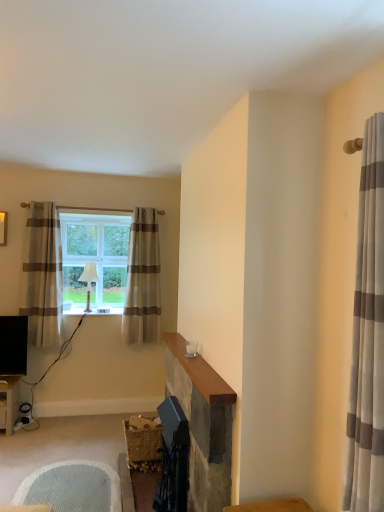
This screenshot has height=512, width=384. What do you see at coordinates (42, 275) in the screenshot?
I see `beige striped curtain at left, the 1th curtain from the left` at bounding box center [42, 275].

Locate an element on the screen. white textured rug at lower left is located at coordinates (72, 487).

What do you see at coordinates (94, 260) in the screenshot? Image resolution: width=384 pixels, height=512 pixels. I see `clear glass window at center` at bounding box center [94, 260].

I want to click on gray striped fabric curtain at right, the third curtain positioned from the back, so click(x=368, y=335).

You are a GUI agent. You are given a task and a screenshot of the screen. Output one action in this format:
    pyautogui.click(x=<x>, y=<y>)
    Task: Click on the beige striped curtain at center, the second curtain positioned from the left
    This screenshot has height=512, width=384.
    Given the screenshot: What is the action you would take?
    pyautogui.click(x=142, y=280)

Does point (72, 485) come behind point (38, 223)?

No, it is not.

Is beige striped curtain at left, arranged as the second curtain when viewed from the back, located within white textured rug at lower left?

That's incorrect, beige striped curtain at left, arranged as the second curtain when viewed from the back, is not inside white textured rug at lower left.

From the image's perspective, who appears lower, white textured rug at lower left or beige striped curtain at left, marked as the second curtain in a front-to-back arrangement?

white textured rug at lower left is shown below in the image.

What's the angular difference between beige striped curtain at left, the 1th curtain from the left, and white fabric lampshade at window's facing directions?

The angular difference between beige striped curtain at left, the 1th curtain from the left, and white fabric lampshade at window is 0.000112 degrees.

Does beige striped curtain at left, marked as the second curtain in a front-to-back arrangement, appear on the left side of white fabric lampshade at window?

Yes, beige striped curtain at left, marked as the second curtain in a front-to-back arrangement, is to the left of white fabric lampshade at window.

From the image's perspective, is beige striped curtain at left, marked as the third curtain in a right-to-left arrangement, on top of white fabric lampshade at window?

Yes, from the image's perspective, beige striped curtain at left, marked as the third curtain in a right-to-left arrangement, is on top of white fabric lampshade at window.

Can we say clear glass window at center lies outside gray striped fabric curtain at right, the 1th curtain in the front-to-back sequence?

Yes, clear glass window at center is outside of gray striped fabric curtain at right, the 1th curtain in the front-to-back sequence.

Is point (88, 211) farther from camera compared to point (378, 178)?

That is True.

Is clear glass window at center bigger or smaller than gray striped fabric curtain at right, the third curtain positioned from the back?

Clearly, clear glass window at center is larger in size than gray striped fabric curtain at right, the third curtain positioned from the back.

Is gray striped fabric curtain at right, the third curtain positioned from the back, oriented towards white fabric lampshade at window?

No, gray striped fabric curtain at right, the third curtain positioned from the back, is not aimed at white fabric lampshade at window.

Is gray striped fabric curtain at right, the 1th curtain in the front-to-back sequence, smaller than white fabric lampshade at window?

No, gray striped fabric curtain at right, the 1th curtain in the front-to-back sequence, is not smaller than white fabric lampshade at window.

From a real-world perspective, is gray striped fabric curtain at right, the 1th curtain in the front-to-back sequence, beneath white fabric lampshade at window?

No, from a real-world perspective, gray striped fabric curtain at right, the 1th curtain in the front-to-back sequence, is not below white fabric lampshade at window.

Relative to white fabric lampshade at window, is gray striped fabric curtain at right, the third curtain positioned from the back, in front or behind?

In the image, gray striped fabric curtain at right, the third curtain positioned from the back, appears in front of white fabric lampshade at window.

From a real-world perspective, is white fabric lampshade at window under white textured rug at lower left?

No.

The image size is (384, 512). What are the coordinates of `lamp to the left of white textured rug at lower left` in the screenshot? It's located at (89, 281).

Is white textured rug at lower left surrounded by white fabric lampshade at window?

No.

Is white fabric lampshade at window in contact with smooth stone fireplace at center?

white fabric lampshade at window and smooth stone fireplace at center are not in contact.

In terms of height, does white fabric lampshade at window look taller or shorter compared to smooth stone fireplace at center?

white fabric lampshade at window is shorter than smooth stone fireplace at center.

Is white fabric lampshade at window oriented away from smooth stone fireplace at center?

That's not correct — white fabric lampshade at window is not looking away from smooth stone fireplace at center.

Does white fabric lampshade at window come behind smooth stone fireplace at center?

Yes, white fabric lampshade at window is further from the viewer.

Which is correct: beige striped curtain at center, positioned as the 2th curtain in right-to-left order, is inside white textured rug at lower left, or outside of it?

beige striped curtain at center, positioned as the 2th curtain in right-to-left order, cannot be found inside white textured rug at lower left.

Considering the sizes of objects beige striped curtain at center, which ranks as the 3th curtain in front-to-back order, and white textured rug at lower left in the image provided, who is thinner, beige striped curtain at center, which ranks as the 3th curtain in front-to-back order, or white textured rug at lower left?

Thinner between the two is beige striped curtain at center, which ranks as the 3th curtain in front-to-back order.

Which point is more forward, (130, 250) or (77, 509)?

The point (77, 509) is more forward.

Find the location of a particular element. swivel chair below the beige striped curtain at left, marked as the second curtain in a front-to-back arrangement (from a real-world perspective) is located at coordinates (72, 487).

You are a GUI agent. You are given a task and a screenshot of the screen. Output one action in this format:
    pyautogui.click(x=<x>, y=<y>)
    Task: Click on the curtain on the left of the white fabric lampshade at window
    The height and width of the screenshot is (512, 384).
    Given the screenshot: What is the action you would take?
    pyautogui.click(x=42, y=275)

Which object lies nearer to the anchor point smooth stone fireplace at center, white textured rug at lower left or clear glass window at center?

Among the two, white textured rug at lower left is located nearer to smooth stone fireplace at center.

Which object lies nearer to the anchor point beige striped curtain at center, which ranks as the first curtain in back-to-front order, gray striped fabric curtain at right, the third curtain positioned from the back, or white textured rug at lower left?

Among the two, white textured rug at lower left is located nearer to beige striped curtain at center, which ranks as the first curtain in back-to-front order.

Looking at this image, when comparing their distances from white textured rug at lower left, does white fabric lampshade at window or beige striped curtain at left, marked as the second curtain in a front-to-back arrangement, seem further?

white fabric lampshade at window is further to white textured rug at lower left.

Which object lies further to the anchor point white fabric lampshade at window, smooth stone fireplace at center or gray striped fabric curtain at right, the third curtain positioned from the back?

The object further to white fabric lampshade at window is gray striped fabric curtain at right, the third curtain positioned from the back.

Looking at this image, considering their positions, is beige striped curtain at left, marked as the second curtain in a front-to-back arrangement, positioned further to clear glass window at center than beige striped curtain at center, which ranks as the first curtain in back-to-front order?

beige striped curtain at center, which ranks as the first curtain in back-to-front order, is positioned further to the anchor clear glass window at center.

Which object lies further to the anchor point beige striped curtain at center, which ranks as the first curtain in back-to-front order, white fabric lampshade at window or beige striped curtain at left, arranged as the second curtain when viewed from the back?

The object further to beige striped curtain at center, which ranks as the first curtain in back-to-front order, is beige striped curtain at left, arranged as the second curtain when viewed from the back.

Estimate the real-world distances between objects in this image. Which object is further from gray striped fabric curtain at right, the third curtain positioned from the back, white fabric lampshade at window or clear glass window at center?

The object further to gray striped fabric curtain at right, the third curtain positioned from the back, is clear glass window at center.

Considering their positions, is white textured rug at lower left positioned further to clear glass window at center than white fabric lampshade at window?

The object further to clear glass window at center is white textured rug at lower left.

At what (x,y) coordinates should I click in order to perform the action: click on window between white fabric lampshade at window and beige striped curtain at center, which ranks as the first curtain in back-to-front order, from left to right. Please return your answer as a coordinate pair (x, y). Looking at the image, I should click on (94, 260).

This screenshot has height=512, width=384. Find the location of `lamp between smooth stone fireplace at center and clear glass window at center along the z-axis`. lamp between smooth stone fireplace at center and clear glass window at center along the z-axis is located at coordinates (89, 281).

Image resolution: width=384 pixels, height=512 pixels. What are the coordinates of `fireplace between gray striped fabric curtain at right, the 1th curtain in the front-to-back sequence, and beige striped curtain at left, marked as the second curtain in a front-to-back arrangement, in the front-back direction` in the screenshot? It's located at (203, 424).

This screenshot has height=512, width=384. What are the coordinates of `swivel chair positioned between smooth stone fireplace at center and beige striped curtain at center, positioned as the 2th curtain in right-to-left order, from near to far` in the screenshot? It's located at [x=72, y=487].